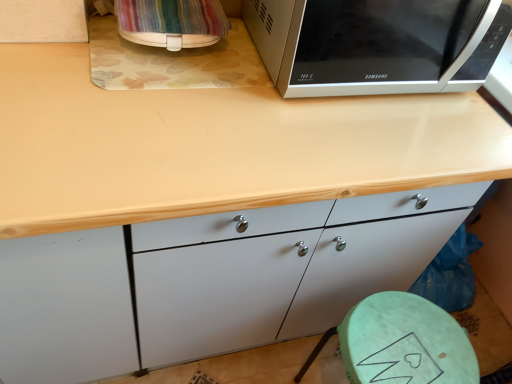
Where is `free location above green matte stool at lower right (from a real-world perspective)`? The image size is (512, 384). free location above green matte stool at lower right (from a real-world perspective) is located at coordinates (411, 341).